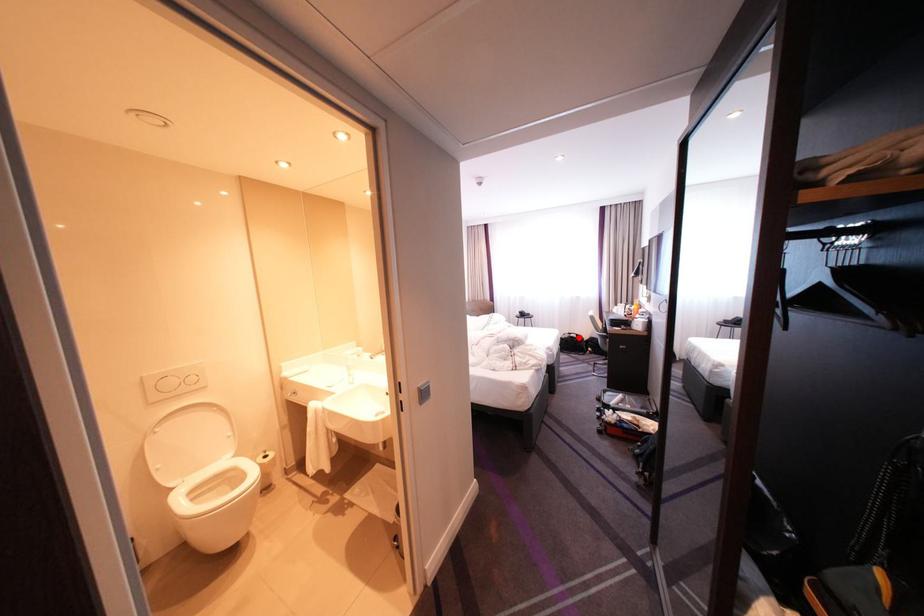
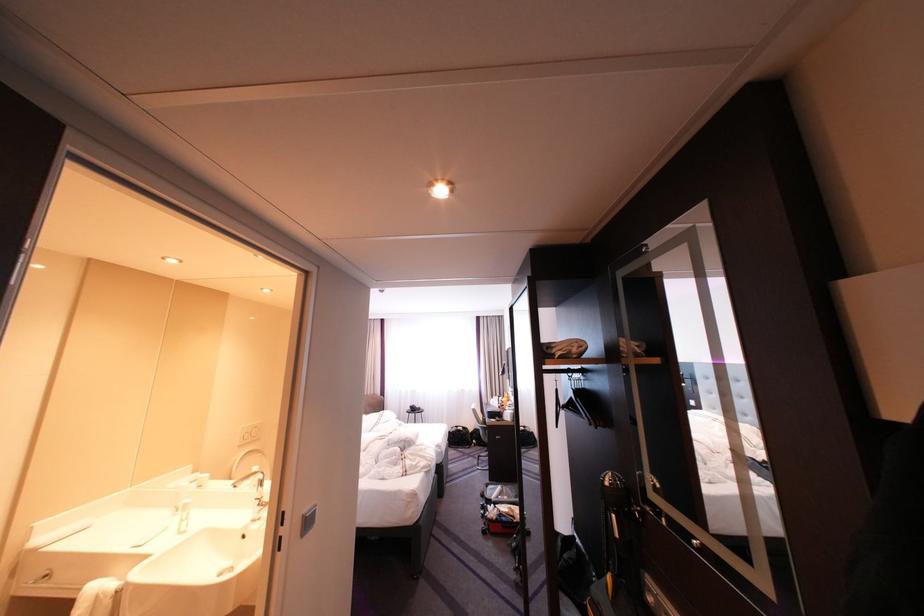
Question: A red point is marked in image1. In image2, is the corresponding 3D point closer to the camera or farther? Reply with the corresponding letter.

Choices:
 (A) The corresponding 3D point is closer.
 (B) The corresponding 3D point is farther.

Answer: (B)